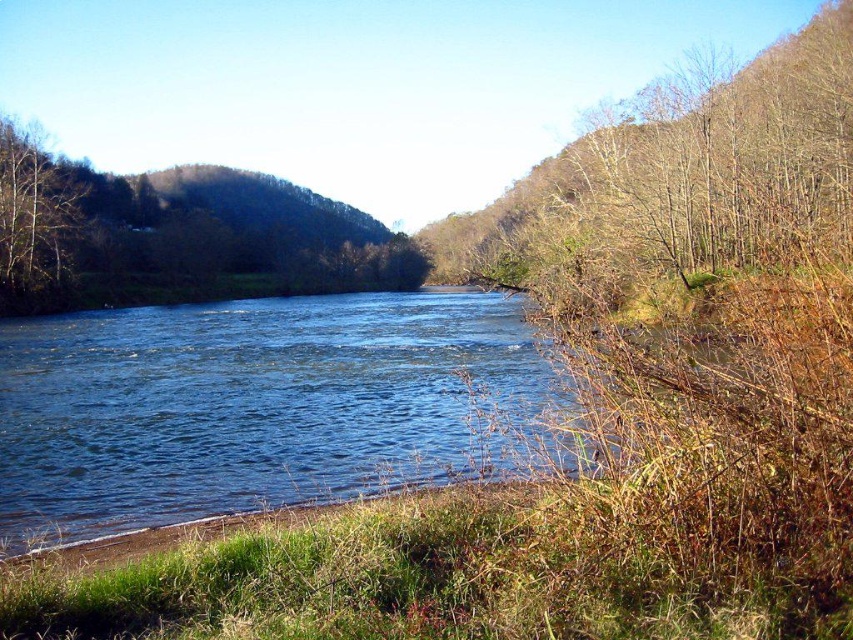
Between brown leafy tree at center and brown leafless tree at left, which one is positioned lower?

Positioned lower is brown leafless tree at left.

The width and height of the screenshot is (853, 640). In order to click on brown leafy tree at center in this screenshot , I will do `click(177, 236)`.